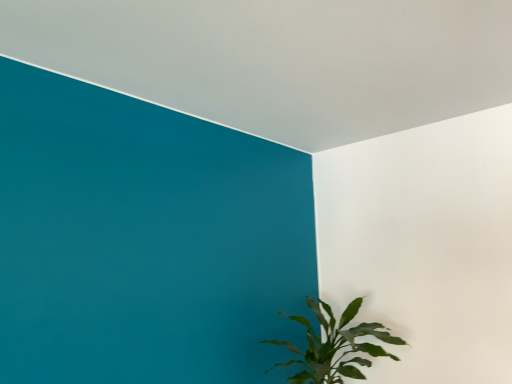
Question: Should I look upward or downward to see green leafy plant at lower right?

Choices:
 (A) down
 (B) up

Answer: (A)